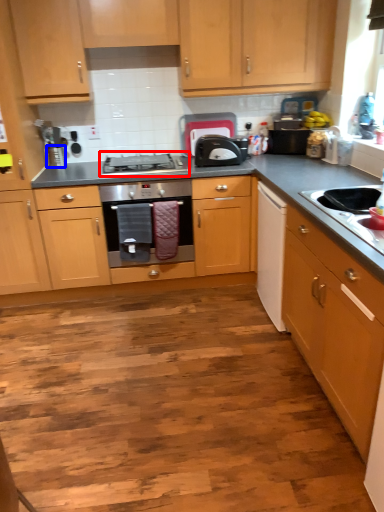
Question: Which object appears farthest to the camera in this image, gas stove (highlighted by a red box) or appliance (highlighted by a blue box)?

Choices:
 (A) gas stove
 (B) appliance

Answer: (B)